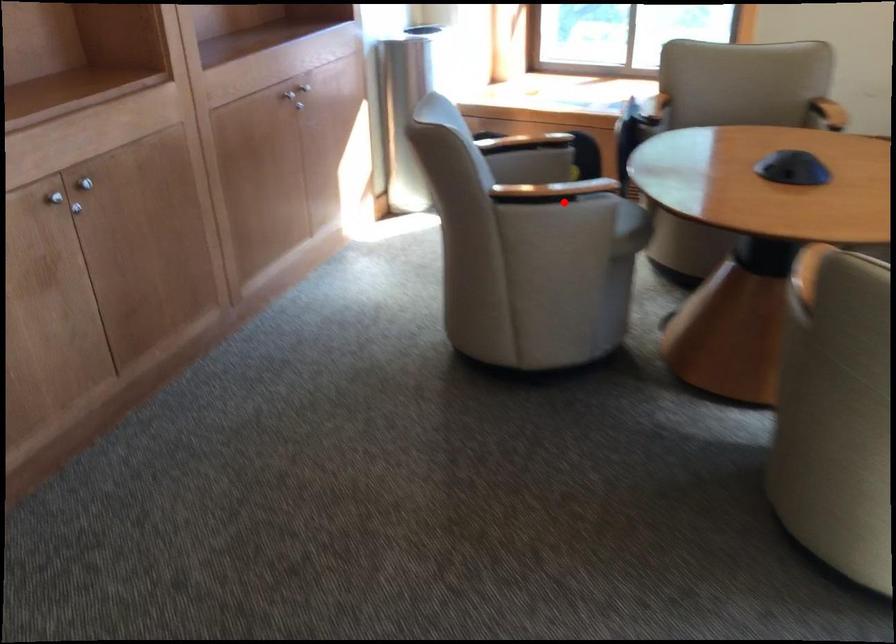
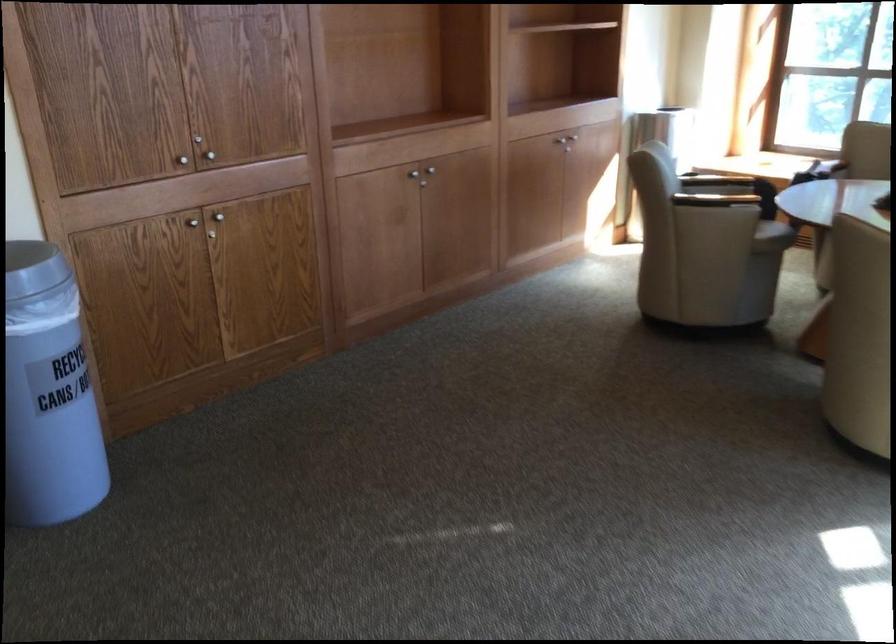
Question: I am providing you with two images of the same scene from different viewpoints. Given a red point in image1, look at the same physical point in image2. Is it:

Choices:
 (A) Closer to the viewpoint
 (B) Farther from the viewpoint

Answer: (B)